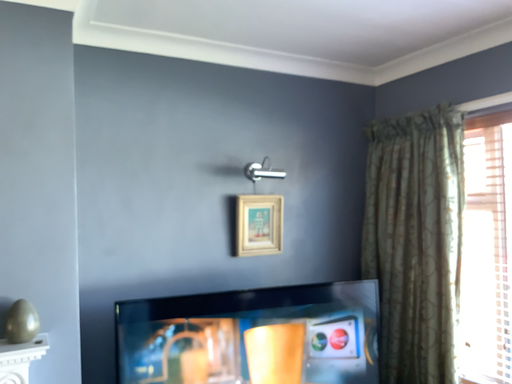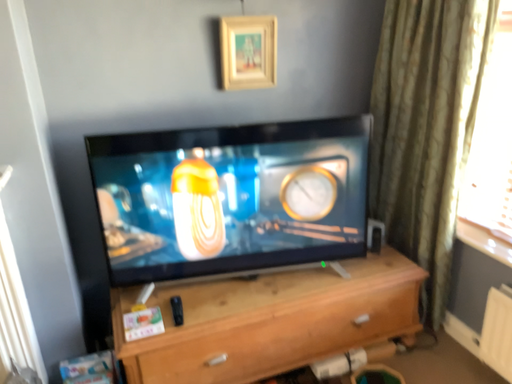
Question: How did the camera likely rotate when shooting the video?

Choices:
 (A) rotated downward
 (B) rotated upward

Answer: (A)